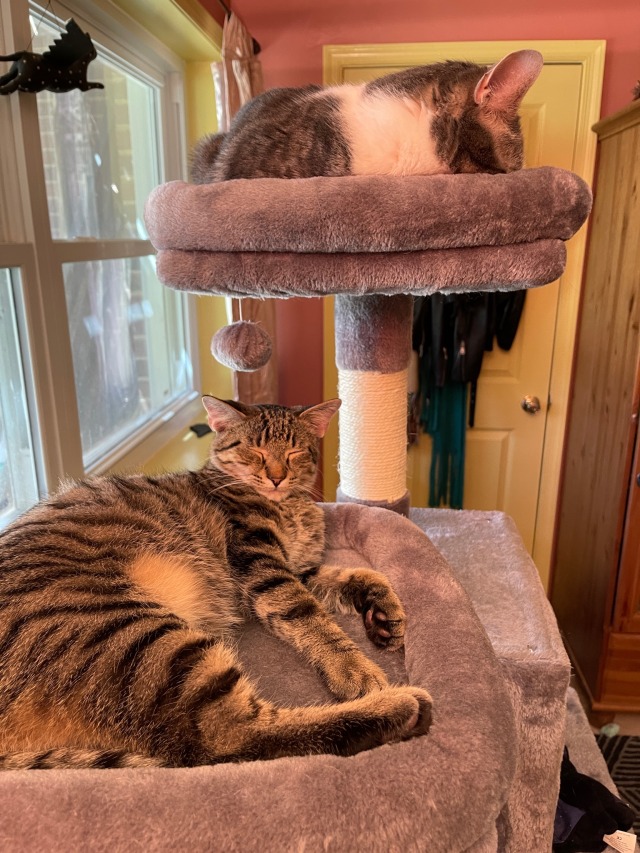
Locate an element on the screen. door is located at coordinates (499, 407).